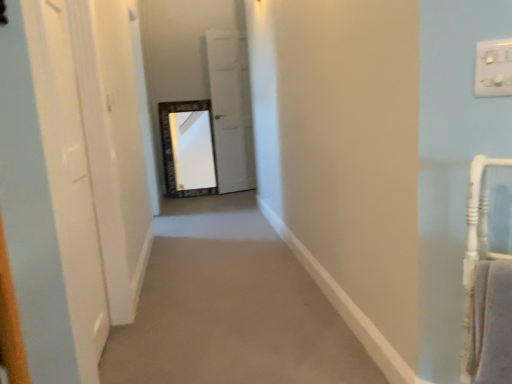
The width and height of the screenshot is (512, 384). In order to click on white glossy door at left, marked as the 1th door in a left-to-right arrangement in this screenshot , I will do `click(47, 195)`.

Locate an element on the screen. white plastic switch at upper right is located at coordinates (493, 68).

Do you think white matte door at center, the 1th door positioned from the right, is within white glossy door at left, the second door positioned from the right, or outside of it?

The correct answer is: outside.

Is the surface of white matte door at center, the 2th door in the left-to-right sequence, in direct contact with white glossy door at left, marked as the 1th door in a left-to-right arrangement?

white matte door at center, the 2th door in the left-to-right sequence, and white glossy door at left, marked as the 1th door in a left-to-right arrangement, are not in contact.

From the image's perspective, which one is positioned higher, white matte door at center, the first door when ordered from back to front, or white glossy door at left, marked as the 1th door in a left-to-right arrangement?

From the image's view, white matte door at center, the first door when ordered from back to front, is above.

Does white plastic switch at upper right have a larger size compared to white matte door at center, the 1th door positioned from the right?

Actually, white plastic switch at upper right might be smaller than white matte door at center, the 1th door positioned from the right.

From the white plastic switch at upper right, count 2nd doors backward and point to it. Please provide its 2D coordinates.

[(231, 110)]

Is the depth of white plastic switch at upper right greater than that of white matte door at center, the 2th door in the left-to-right sequence?

No.

From the image's perspective, does white glossy door at left, which ranks as the second door in back-to-front order, appear higher than white matte door at center, the 2th door in the left-to-right sequence?

No, from the image's perspective, white glossy door at left, which ranks as the second door in back-to-front order, is not above white matte door at center, the 2th door in the left-to-right sequence.

In the scene shown: Considering the positions of objects white glossy door at left, which ranks as the second door in back-to-front order, and white matte door at center, the 1th door positioned from the right, in the image provided, who is in front, white glossy door at left, which ranks as the second door in back-to-front order, or white matte door at center, the 1th door positioned from the right,?

Positioned in front is white glossy door at left, which ranks as the second door in back-to-front order.

Which of these two, white glossy door at left, which ranks as the second door in back-to-front order, or white matte door at center, the 2th door in the left-to-right sequence, is bigger?

Bigger between the two is white matte door at center, the 2th door in the left-to-right sequence.

From a real-world perspective, which is physically above, white glossy door at left, the second door positioned from the right, or white matte door at center, the 1th door positioned from the right?

In real-world perspective, white matte door at center, the 1th door positioned from the right, is above.

Is white plastic switch at upper right shorter than white glossy door at left, which ranks as the second door in back-to-front order?

Yes, white plastic switch at upper right is shorter than white glossy door at left, which ranks as the second door in back-to-front order.

Which is nearer, (476,89) or (22,62)?

Point (476,89) appears to be farther away from the viewer than point (22,62).

Is white plastic switch at upper right completely or partially outside of white glossy door at left, acting as the first door starting from the front?

Yes, white plastic switch at upper right is not within white glossy door at left, acting as the first door starting from the front.

From the image's perspective, is white plastic switch at upper right located above white glossy door at left, which ranks as the second door in back-to-front order?

Yes.

How different are the orientations of white matte door at center, the first door when ordered from back to front, and white plastic switch at upper right in degrees?

There is a 62.7-degree angle between the facing directions of white matte door at center, the first door when ordered from back to front, and white plastic switch at upper right.

From the image's perspective, is white matte door at center, the 1th door positioned from the right, on top of white plastic switch at upper right?

Yes, from the image's perspective, white matte door at center, the 1th door positioned from the right, is on top of white plastic switch at upper right.

Does white matte door at center, the first door when ordered from back to front, have a greater width compared to white plastic switch at upper right?

Indeed, white matte door at center, the first door when ordered from back to front, has a greater width compared to white plastic switch at upper right.

Considering the relative positions of white glossy door at left, marked as the 1th door in a left-to-right arrangement, and white plastic switch at upper right in the image provided, is white glossy door at left, marked as the 1th door in a left-to-right arrangement, to the left or to the right of white plastic switch at upper right?

From the image, it's evident that white glossy door at left, marked as the 1th door in a left-to-right arrangement, is to the left of white plastic switch at upper right.

Considering the positions of points (80, 381) and (492, 49), is point (80, 381) closer to camera compared to point (492, 49)?

No.

In terms of height, does white glossy door at left, which ranks as the second door in back-to-front order, look taller or shorter compared to white plastic switch at upper right?

Considering their sizes, white glossy door at left, which ranks as the second door in back-to-front order, has more height than white plastic switch at upper right.

In the image, there is a white glossy door at left, the second door positioned from the right. In order to click on door above it (from the image's perspective) in this screenshot , I will do `click(231, 110)`.

Locate an element on the screen. Image resolution: width=512 pixels, height=384 pixels. electric outlet in front of the white matte door at center, the 2th door in the left-to-right sequence is located at coordinates (493, 68).

When comparing their distances from white matte door at center, the 1th door positioned from the right, does white glossy door at left, which ranks as the second door in back-to-front order, or white plastic switch at upper right seem closer?

white glossy door at left, which ranks as the second door in back-to-front order.

Looking at the image, which one is located closer to white glossy door at left, acting as the first door starting from the front, white matte door at center, the 2th door in the left-to-right sequence, or white plastic switch at upper right?

white plastic switch at upper right is positioned closer to the anchor white glossy door at left, acting as the first door starting from the front.

Which object lies nearer to the anchor point white plastic switch at upper right, white glossy door at left, acting as the first door starting from the front, or white matte door at center, the first door when ordered from back to front?

Based on the image, white glossy door at left, acting as the first door starting from the front, appears to be nearer to white plastic switch at upper right.

From the image, which object appears to be farther from white matte door at center, the 2th door when ordered from front to back, white plastic switch at upper right or white glossy door at left, which ranks as the second door in back-to-front order?

Based on the image, white plastic switch at upper right appears to be further to white matte door at center, the 2th door when ordered from front to back.

Looking at the image, which one is located further to white glossy door at left, the second door positioned from the right, white plastic switch at upper right or white matte door at center, the 1th door positioned from the right?

The object further to white glossy door at left, the second door positioned from the right, is white matte door at center, the 1th door positioned from the right.

Considering their positions, is white matte door at center, the 2th door when ordered from front to back, positioned further to white plastic switch at upper right than white glossy door at left, acting as the first door starting from the front?

Based on the image, white matte door at center, the 2th door when ordered from front to back, appears to be further to white plastic switch at upper right.

You are a GUI agent. You are given a task and a screenshot of the screen. Output one action in this format:
    pyautogui.click(x=<x>, y=<y>)
    Task: Click on the door between white plastic switch at upper right and white matte door at center, the 2th door when ordered from front to back, in the front-back direction
    
    Given the screenshot: What is the action you would take?
    pyautogui.click(x=47, y=195)